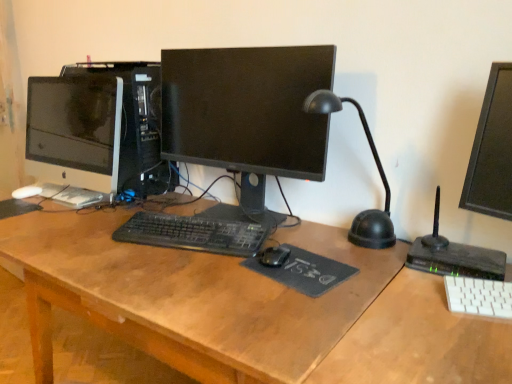
Where is `vacant space in front of black matte keyboard at center, acting as the second computer keyboard starting from the bottom`? The width and height of the screenshot is (512, 384). vacant space in front of black matte keyboard at center, acting as the second computer keyboard starting from the bottom is located at coordinates (182, 275).